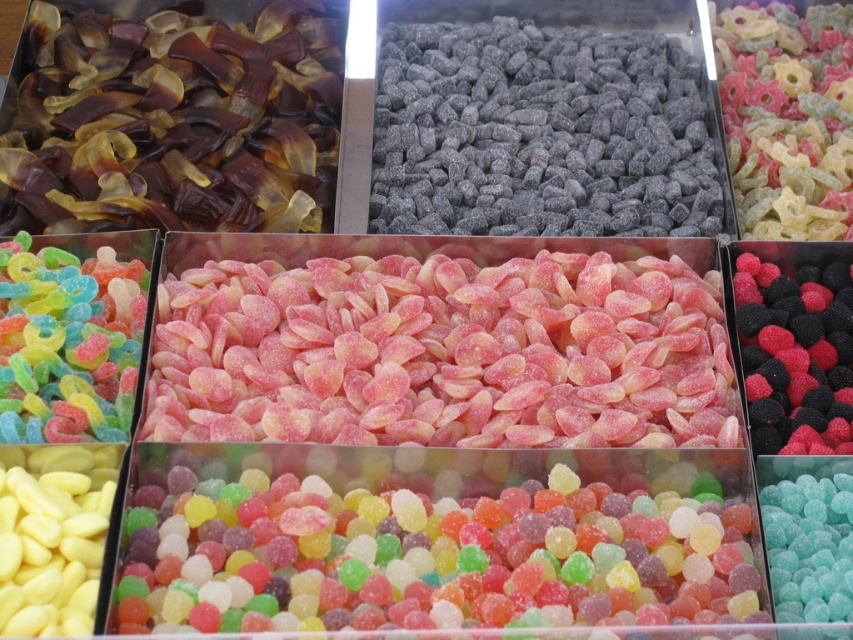
At what (x,y) coordinates should I click in order to perform the action: click on glossy sugar-coated candies at center. Please return your answer as a coordinate pair (x, y). This screenshot has width=853, height=640. Looking at the image, I should click on (428, 556).

Can you confirm if glossy sugar-coated candies at center is positioned to the right of black matte berry at center?

In fact, glossy sugar-coated candies at center is to the left of black matte berry at center.

Who is more forward, (415, 497) or (740, 280)?

Point (415, 497)

You are a GUI agent. You are given a task and a screenshot of the screen. Output one action in this format:
    pyautogui.click(x=<x>, y=<y>)
    Task: Click on the glossy sugar-coated candies at center
    The image size is (853, 640).
    Given the screenshot: What is the action you would take?
    pyautogui.click(x=428, y=556)

Does glossy sugar-coated candies at center have a lesser height compared to translucent sugar-coated rings at center?

Correct, glossy sugar-coated candies at center is not as tall as translucent sugar-coated rings at center.

Identify the location of glossy sugar-coated candies at center. Image resolution: width=853 pixels, height=640 pixels. (428, 556).

Which is behind, point (639, 547) or point (109, 404)?

The point (109, 404) is more distant.

Where is `glossy sugar-coated candies at center`? Image resolution: width=853 pixels, height=640 pixels. glossy sugar-coated candies at center is located at coordinates (428, 556).

Is translucent yellow gummy bear at center positioned in front of translucent sugar-coated rings at center?

That is False.

Does point (758, 54) come farther from viewer compared to point (28, 390)?

Yes, point (758, 54) is farther from viewer.

This screenshot has width=853, height=640. What are the coordinates of `translucent yellow gummy bear at center` in the screenshot? It's located at (787, 116).